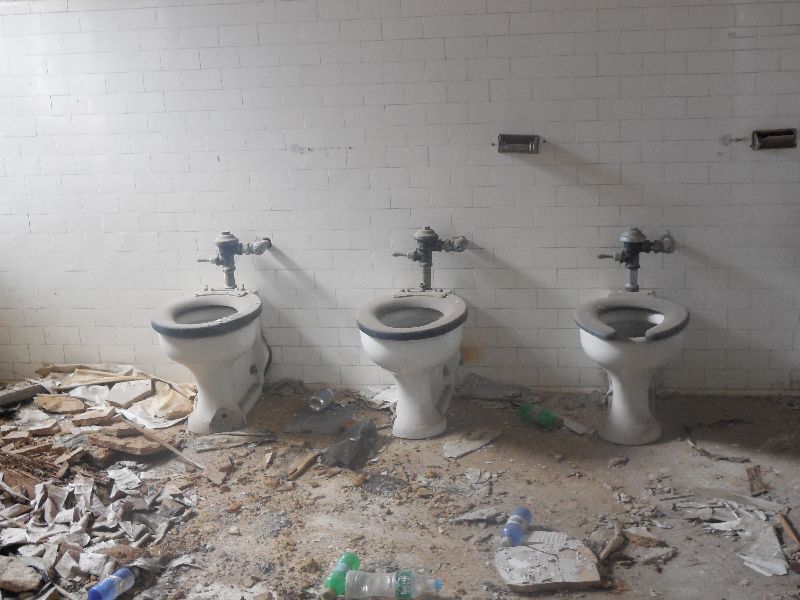
The image size is (800, 600). I want to click on roll holder, so 518,152.